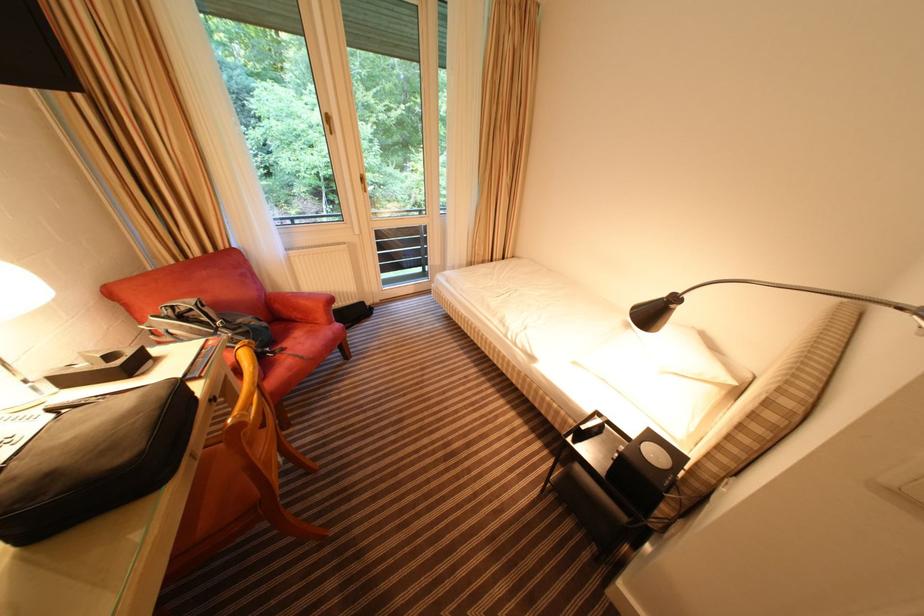
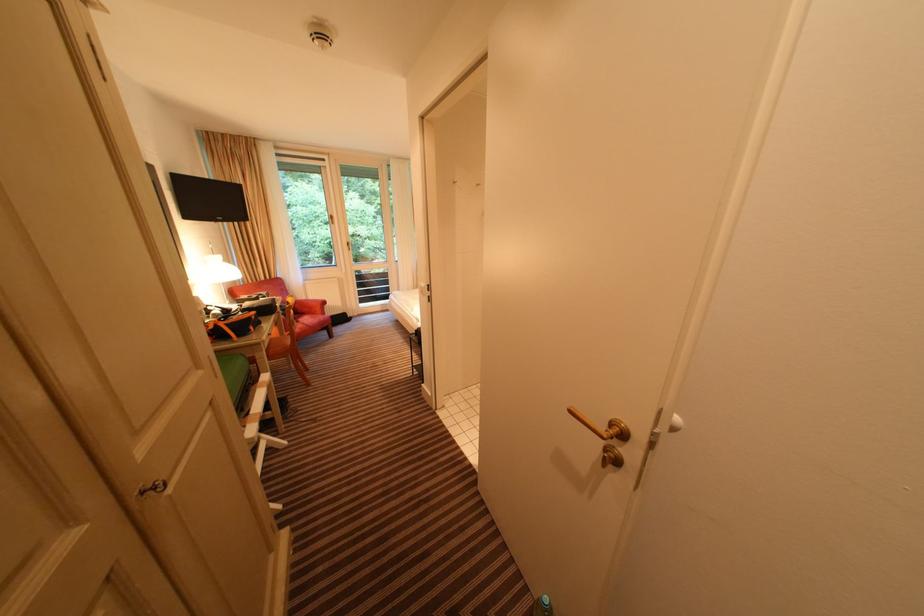
The images are taken continuously from a first-person perspective. In which direction are you moving?

The cameraman moved toward right, backward.